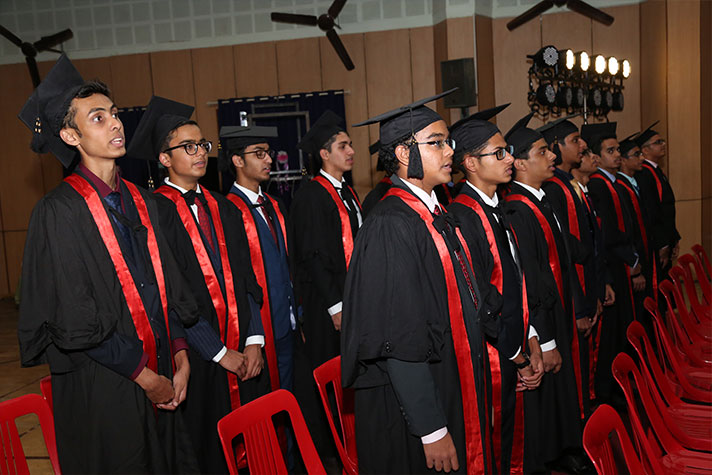
I want to click on wall, so click(189, 82).